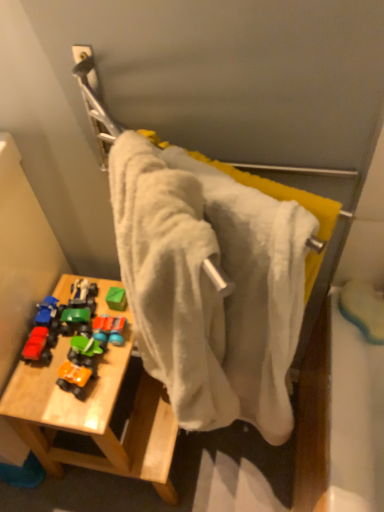
Question: Can you confirm if orange matte toy car at lower left, which is counted as the third toy, starting from the left, is shorter than wooden table at lower left?

Choices:
 (A) yes
 (B) no

Answer: (A)

Question: Is orange matte toy car at lower left, which appears as the 2th toy when viewed from the right, positioned far away from wooden table at lower left?

Choices:
 (A) yes
 (B) no

Answer: (B)

Question: Does orange matte toy car at lower left, which is counted as the third toy, starting from the left, have a lesser width compared to wooden table at lower left?

Choices:
 (A) no
 (B) yes

Answer: (B)

Question: Is orange matte toy car at lower left, which is counted as the third toy, starting from the left, in contact with wooden table at lower left?

Choices:
 (A) no
 (B) yes

Answer: (A)

Question: Would you say orange matte toy car at lower left, which appears as the 2th toy when viewed from the right, contains wooden table at lower left?

Choices:
 (A) no
 (B) yes

Answer: (A)

Question: Looking at their shapes, would you say rubberized plastic toy car at center, the fourth toy from the left, is wider or thinner than wooden table at lower left?

Choices:
 (A) thin
 (B) wide

Answer: (A)

Question: Would you say rubberized plastic toy car at center, the 1th toy from the right, is to the left or to the right of wooden table at lower left in the picture?

Choices:
 (A) left
 (B) right

Answer: (A)

Question: Considering the positions of rubberized plastic toy car at center, the fourth toy from the left, and wooden table at lower left in the image, is rubberized plastic toy car at center, the fourth toy from the left, taller or shorter than wooden table at lower left?

Choices:
 (A) tall
 (B) short

Answer: (B)

Question: Is rubberized plastic toy car at center, the 1th toy from the right, situated inside wooden table at lower left or outside?

Choices:
 (A) outside
 (B) inside

Answer: (B)

Question: Based on their sizes in the image, would you say wooden table at lower left is bigger or smaller than matte blue car at left, which appears as the third toy when viewed from the right?

Choices:
 (A) small
 (B) big

Answer: (B)

Question: From the image's perspective, relative to matte blue car at left, which appears as the third toy when viewed from the right, is wooden table at lower left above or below?

Choices:
 (A) below
 (B) above

Answer: (A)

Question: Do you think wooden table at lower left is within matte blue car at left, which appears as the third toy when viewed from the right, or outside of it?

Choices:
 (A) outside
 (B) inside

Answer: (A)

Question: Is wooden table at lower left wider or thinner than matte blue car at left, which appears as the third toy when viewed from the right?

Choices:
 (A) wide
 (B) thin

Answer: (A)

Question: From a real-world perspective, is matte red toy car at left, which appears as the 4th toy when viewed from the right, above or below white fabric towel at center?

Choices:
 (A) below
 (B) above

Answer: (A)

Question: Which is correct: matte red toy car at left, which appears as the 4th toy when viewed from the right, is inside white fabric towel at center, or outside of it?

Choices:
 (A) outside
 (B) inside

Answer: (A)